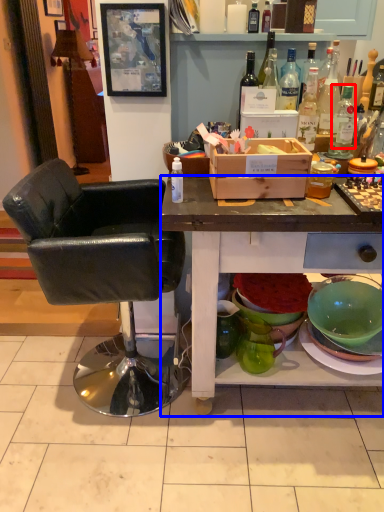
Question: Which object appears farthest to the camera in this image, bottle (highlighted by a red box) or desk (highlighted by a blue box)?

Choices:
 (A) bottle
 (B) desk

Answer: (A)